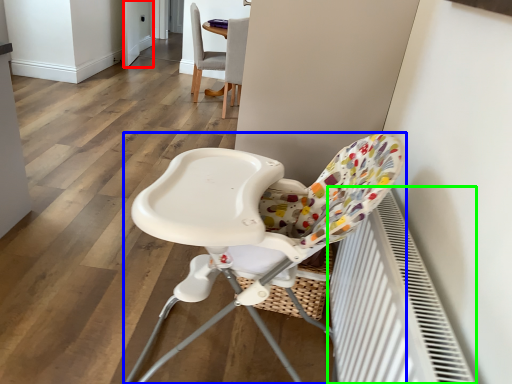
Question: Based on their relative distances, which object is nearer to screen door (highlighted by a red box)? Choose from chair (highlighted by a blue box) and radiator (highlighted by a green box).

Choices:
 (A) chair
 (B) radiator

Answer: (A)